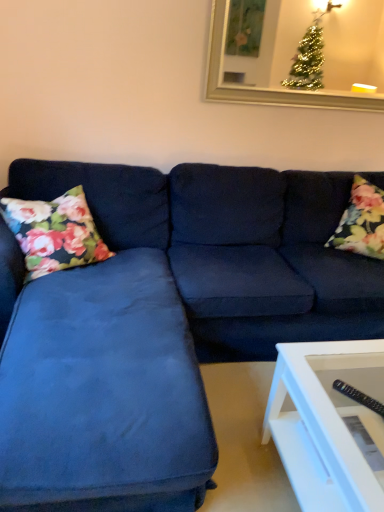
Question: Is floral fabric pillow at left, which ranks as the first pillow in left-to-right order, taller or shorter than floral fabric pillow at right, the first pillow viewed from the right?

Choices:
 (A) short
 (B) tall

Answer: (A)

Question: Is floral fabric pillow at left, placed as the 2th pillow when sorted from right to left, to the left or to the right of floral fabric pillow at right, the first pillow viewed from the right, in the image?

Choices:
 (A) left
 (B) right

Answer: (A)

Question: Estimate the real-world distances between objects in this image. Which object is closer to the gold-framed mirror at upper center?

Choices:
 (A) suede blue couch at center
 (B) floral fabric pillow at right, the first pillow viewed from the right
 (C) floral fabric pillow at left, which ranks as the first pillow in left-to-right order

Answer: (B)

Question: Considering the real-world distances, which object is closest to the gold-framed mirror at upper center?

Choices:
 (A) suede blue couch at center
 (B) floral fabric pillow at left, which ranks as the first pillow in left-to-right order
 (C) floral fabric pillow at right, which ranks as the second pillow in left-to-right order

Answer: (C)